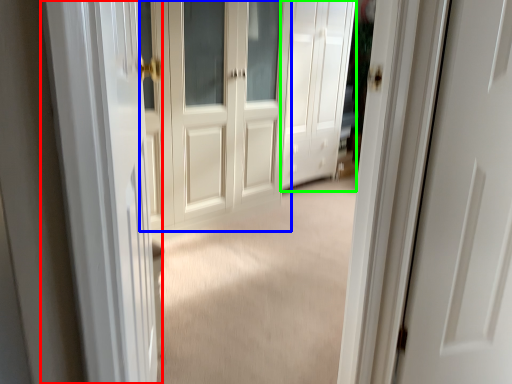
Question: Which object is positioned farthest from screen door (highlighted by a red box)? Select from door (highlighted by a blue box) and door (highlighted by a green box).

Choices:
 (A) door
 (B) door

Answer: (B)